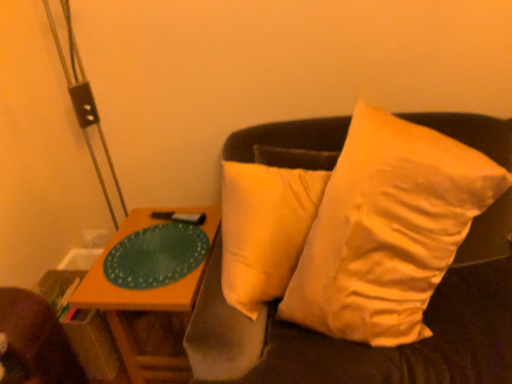
The image size is (512, 384). Identify the location of free region under green matte glass plate at left (from a real-world perspective). (155, 245).